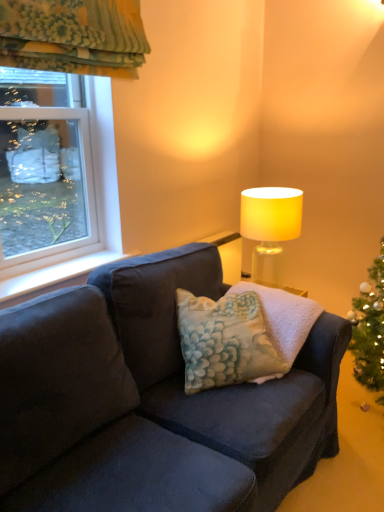
Measure the distance between white smooth window sill at left and camera.

1.61 meters.

The image size is (384, 512). What are the coordinates of `white smooth window sill at left` in the screenshot? It's located at (54, 275).

What is the approximate width of fluffy fabric pillow at center?

14.20 inches.

This screenshot has height=512, width=384. In order to click on clear glass window at upper left in this screenshot , I will do `click(75, 182)`.

You are a GUI agent. You are given a task and a screenshot of the screen. Output one action in this format:
    pyautogui.click(x=<x>, y=<y>)
    Task: Click on the white smooth window sill at left
    Image resolution: width=384 pixels, height=512 pixels.
    Given the screenshot: What is the action you would take?
    pyautogui.click(x=54, y=275)

Does matte yellow lampshade at upper right lie behind fluffy fabric pillow at center?

Yes, the depth of matte yellow lampshade at upper right is greater than that of fluffy fabric pillow at center.

Consider the image. Which object is positioned more to the right, matte yellow lampshade at upper right or fluffy fabric pillow at center?

From the viewer's perspective, matte yellow lampshade at upper right appears more on the right side.

Between matte yellow lampshade at upper right and fluffy fabric pillow at center, which one has less height?

fluffy fabric pillow at center.

Based on the photo, considering the relative sizes of white smooth window sill at left and matte yellow lampshade at upper right in the image provided, is white smooth window sill at left bigger than matte yellow lampshade at upper right?

No, white smooth window sill at left is not bigger than matte yellow lampshade at upper right.

Does white smooth window sill at left contain matte yellow lampshade at upper right?

No, matte yellow lampshade at upper right is not surrounded by white smooth window sill at left.

Are white smooth window sill at left and matte yellow lampshade at upper right making contact?

white smooth window sill at left and matte yellow lampshade at upper right are clearly separated.

Measure the distance between white smooth window sill at left and matte yellow lampshade at upper right.

35.23 inches.

Is matte yellow lampshade at upper right located outside white smooth window sill at left?

matte yellow lampshade at upper right lies outside white smooth window sill at left's area.

Is matte yellow lampshade at upper right beside white smooth window sill at left?

matte yellow lampshade at upper right and white smooth window sill at left are not in contact.

Which point is more distant from viewer, (291, 238) or (53, 269)?

The point (291, 238) is more distant.

Based on the photo, considering the positions of objects matte yellow lampshade at upper right and white smooth window sill at left in the image provided, who is in front, matte yellow lampshade at upper right or white smooth window sill at left?

white smooth window sill at left.

How different are the orientations of white smooth window sill at left and clear glass window at upper left in degrees?

Result: 0.802 degrees.

Are white smooth window sill at left and clear glass window at upper left making contact?

They are not placed beside each other.

Can we say white smooth window sill at left lies outside clear glass window at upper left?

Yes.

Which object is positioned more to the right, white smooth window sill at left or clear glass window at upper left?

From the viewer's perspective, white smooth window sill at left appears more on the right side.

Between clear glass window at upper left and matte yellow lampshade at upper right, which one is positioned in front?

clear glass window at upper left is in front.

Identify the location of window lying above the matte yellow lampshade at upper right (from the image's perspective). The image size is (384, 512). (75, 182).

Between clear glass window at upper left and fluffy fabric pillow at center, which one is positioned in front?

Positioned in front is fluffy fabric pillow at center.

Is clear glass window at upper left far from fluffy fabric pillow at center?

clear glass window at upper left is near fluffy fabric pillow at center, not far away.

How different are the orientations of clear glass window at upper left and fluffy fabric pillow at center in degrees?

The facing directions of clear glass window at upper left and fluffy fabric pillow at center are 38.9 degrees apart.

Considering the relative positions of matte yellow lampshade at upper right and clear glass window at upper left in the image provided, is matte yellow lampshade at upper right to the right of clear glass window at upper left from the viewer's perspective?

Indeed, matte yellow lampshade at upper right is positioned on the right side of clear glass window at upper left.

Between point (298, 223) and point (40, 121), which one is positioned in front?

The point (40, 121) is closer to the camera.

Considering the sizes of matte yellow lampshade at upper right and clear glass window at upper left in the image, is matte yellow lampshade at upper right wider or thinner than clear glass window at upper left?

In the image, matte yellow lampshade at upper right appears to be wider than clear glass window at upper left.

Is matte yellow lampshade at upper right taller or shorter than clear glass window at upper left?

Considering their sizes, matte yellow lampshade at upper right has less height than clear glass window at upper left.

At what (x,y) coordinates should I click in order to perform the action: click on lamp above the fluffy fabric pillow at center (from the image's perspective). Please return your answer as a coordinate pair (x, y). The image size is (384, 512). Looking at the image, I should click on coord(270,228).

Locate an element on the screen. The height and width of the screenshot is (512, 384). window sill lying below the matte yellow lampshade at upper right (from the image's perspective) is located at coordinates (54, 275).

Based on their spatial positions, is matte yellow lampshade at upper right or clear glass window at upper left further from fluffy fabric pillow at center?

Based on the image, clear glass window at upper left appears to be further to fluffy fabric pillow at center.

When comparing their distances from matte yellow lampshade at upper right, does fluffy fabric pillow at center or white smooth window sill at left seem closer?

Among the two, fluffy fabric pillow at center is located nearer to matte yellow lampshade at upper right.

Considering their positions, is fluffy fabric pillow at center positioned further to white smooth window sill at left than clear glass window at upper left?

The object further to white smooth window sill at left is fluffy fabric pillow at center.

Which object lies further to the anchor point white smooth window sill at left, matte yellow lampshade at upper right or fluffy fabric pillow at center?

The object further to white smooth window sill at left is matte yellow lampshade at upper right.

Which object lies further to the anchor point fluffy fabric pillow at center, matte yellow lampshade at upper right or white smooth window sill at left?

matte yellow lampshade at upper right lies further to fluffy fabric pillow at center than the other object.

When comparing their distances from white smooth window sill at left, does matte yellow lampshade at upper right or clear glass window at upper left seem further?

matte yellow lampshade at upper right is further to white smooth window sill at left.

Which object lies nearer to the anchor point matte yellow lampshade at upper right, white smooth window sill at left or fluffy fabric pillow at center?

Among the two, fluffy fabric pillow at center is located nearer to matte yellow lampshade at upper right.

Consider the image. Estimate the real-world distances between objects in this image. Which object is closer to clear glass window at upper left, matte yellow lampshade at upper right or white smooth window sill at left?

white smooth window sill at left.

Find the location of a particular element. The width and height of the screenshot is (384, 512). window sill between clear glass window at upper left and matte yellow lampshade at upper right from left to right is located at coordinates (54, 275).

Find the location of a particular element. The image size is (384, 512). pillow situated between clear glass window at upper left and matte yellow lampshade at upper right from left to right is located at coordinates (224, 341).

I want to click on pillow between white smooth window sill at left and matte yellow lampshade at upper right in the horizontal direction, so click(224, 341).

Locate an element on the screen. This screenshot has height=512, width=384. window sill between clear glass window at upper left and fluffy fabric pillow at center in the horizontal direction is located at coordinates (54, 275).